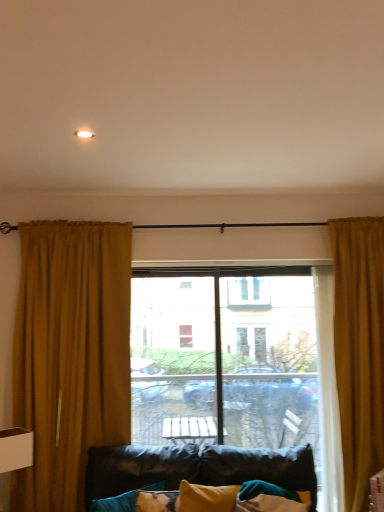
Question: Is the depth of mustard velvet curtain at left, the 1th curtain when ordered from left to right, greater than that of golden textured curtain at right, which is the 2th curtain in left-to-right order?

Choices:
 (A) no
 (B) yes

Answer: (B)

Question: Is mustard velvet curtain at left, placed as the second curtain when sorted from right to left, outside golden textured curtain at right, which is the 2th curtain in left-to-right order?

Choices:
 (A) yes
 (B) no

Answer: (A)

Question: From a real-world perspective, is mustard velvet curtain at left, the 1th curtain when ordered from left to right, beneath golden textured curtain at right, which is the 2th curtain in left-to-right order?

Choices:
 (A) yes
 (B) no

Answer: (B)

Question: Would you say mustard velvet curtain at left, the 1th curtain when ordered from left to right, is a long distance from golden textured curtain at right, which is the 2th curtain in left-to-right order?

Choices:
 (A) yes
 (B) no

Answer: (A)

Question: Is mustard velvet curtain at left, the 1th curtain when ordered from left to right, facing away from golden textured curtain at right, which is the 2th curtain in left-to-right order?

Choices:
 (A) no
 (B) yes

Answer: (A)

Question: Is point (248, 434) closer or farther from the camera than point (115, 421)?

Choices:
 (A) closer
 (B) farther

Answer: (B)

Question: From a real-world perspective, relative to mustard velvet curtain at left, the 1th curtain when ordered from left to right, is transparent glass window at center vertically above or below?

Choices:
 (A) below
 (B) above

Answer: (A)

Question: Looking at their shapes, would you say transparent glass window at center is wider or thinner than mustard velvet curtain at left, placed as the second curtain when sorted from right to left?

Choices:
 (A) wide
 (B) thin

Answer: (A)

Question: From the image's perspective, relative to mustard velvet curtain at left, placed as the second curtain when sorted from right to left, is transparent glass window at center above or below?

Choices:
 (A) below
 (B) above

Answer: (A)

Question: Is point (34, 311) closer or farther from the camera than point (309, 296)?

Choices:
 (A) farther
 (B) closer

Answer: (B)

Question: Is mustard velvet curtain at left, the 1th curtain when ordered from left to right, bigger or smaller than transparent glass window at center?

Choices:
 (A) small
 (B) big

Answer: (A)

Question: Is mustard velvet curtain at left, the 1th curtain when ordered from left to right, to the left or to the right of transparent glass window at center in the image?

Choices:
 (A) right
 (B) left

Answer: (B)

Question: Considering the positions of mustard velvet curtain at left, the 1th curtain when ordered from left to right, and transparent glass window at center in the image, is mustard velvet curtain at left, the 1th curtain when ordered from left to right, wider or thinner than transparent glass window at center?

Choices:
 (A) wide
 (B) thin

Answer: (B)

Question: In terms of size, does transparent glass window at center appear bigger or smaller than golden textured curtain at right, which appears as the 1th curtain when viewed from the right?

Choices:
 (A) big
 (B) small

Answer: (A)

Question: From a real-world perspective, is transparent glass window at center above or below golden textured curtain at right, which appears as the 1th curtain when viewed from the right?

Choices:
 (A) above
 (B) below

Answer: (B)